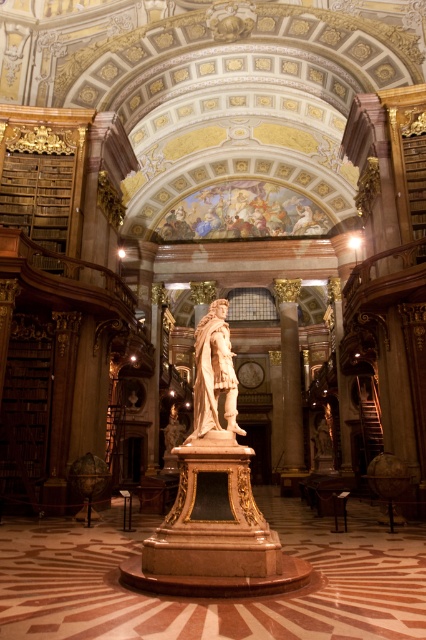
Does polished bronze statue at center have a lesser height compared to polished marble column at center?

Yes.

This screenshot has height=640, width=426. Describe the element at coordinates (213, 372) in the screenshot. I see `polished bronze statue at center` at that location.

Is point (227, 330) more distant than point (291, 285)?

No, (227, 330) is in front of (291, 285).

Where is `polished bronze statue at center`? Image resolution: width=426 pixels, height=640 pixels. polished bronze statue at center is located at coordinates (213, 372).